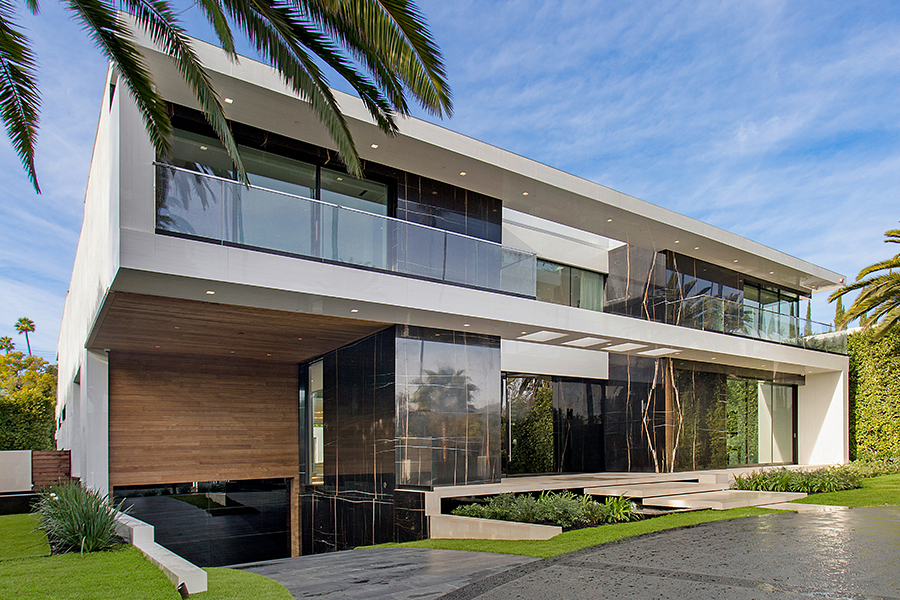
Where is `glass`? glass is located at coordinates (435, 432).